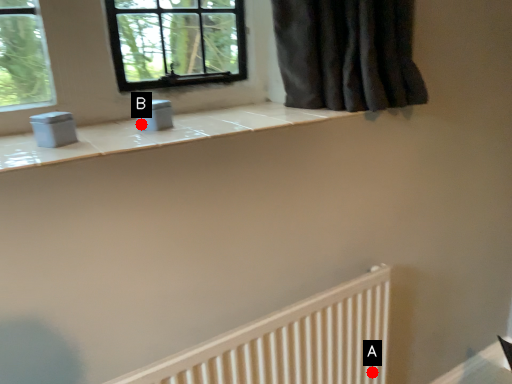
Question: Two points are circled on the image, labeled by A and B beside each circle. Which point is closer to the camera?

Choices:
 (A) A is closer
 (B) B is closer

Answer: (B)